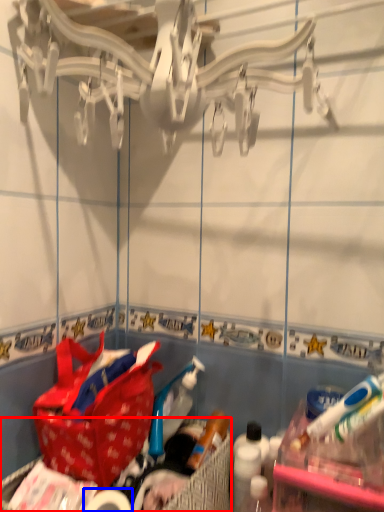
Question: Which object appears closest to the camera in this image, picnic basket (highlighted by a red box) or toilet paper (highlighted by a blue box)?

Choices:
 (A) picnic basket
 (B) toilet paper

Answer: (A)